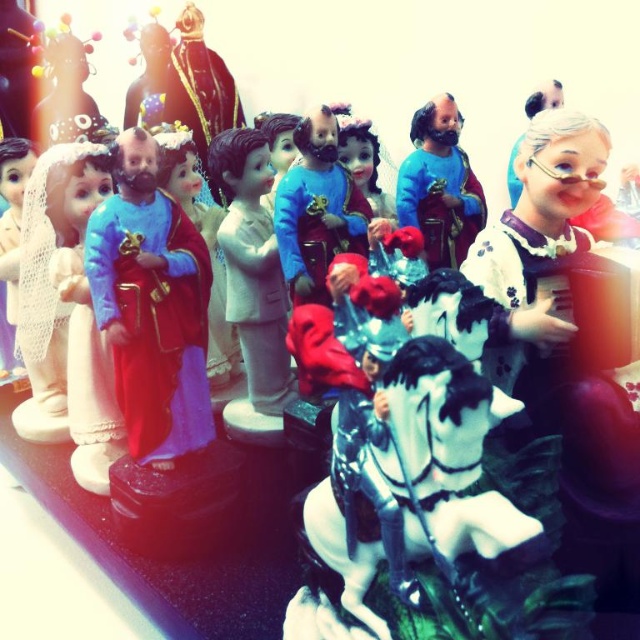
Question: Is matte porcelain doll at center below matte black figurine at upper left?

Choices:
 (A) no
 (B) yes

Answer: (B)

Question: Is matte porcelain doll at left further to camera compared to blue glossy statue at center?

Choices:
 (A) yes
 (B) no

Answer: (B)

Question: Which object is the closest to the matte plastic figurine at center?

Choices:
 (A) matte black figurine at upper left
 (B) blue glossy statue at center
 (C) matte porcelain doll at left

Answer: (C)

Question: Which point appears closest to the camera in this image?

Choices:
 (A) (129, 401)
 (B) (464, 541)

Answer: (B)

Question: Among these objects, which one is nearest to the camera?

Choices:
 (A) matte porcelain doll at center
 (B) white glossy horse at center
 (C) matte black figurine at upper left
 (D) matte plastic figurine at center

Answer: (B)

Question: Can you confirm if matte porcelain doll at left is smaller than matte porcelain doll at center?

Choices:
 (A) no
 (B) yes

Answer: (A)